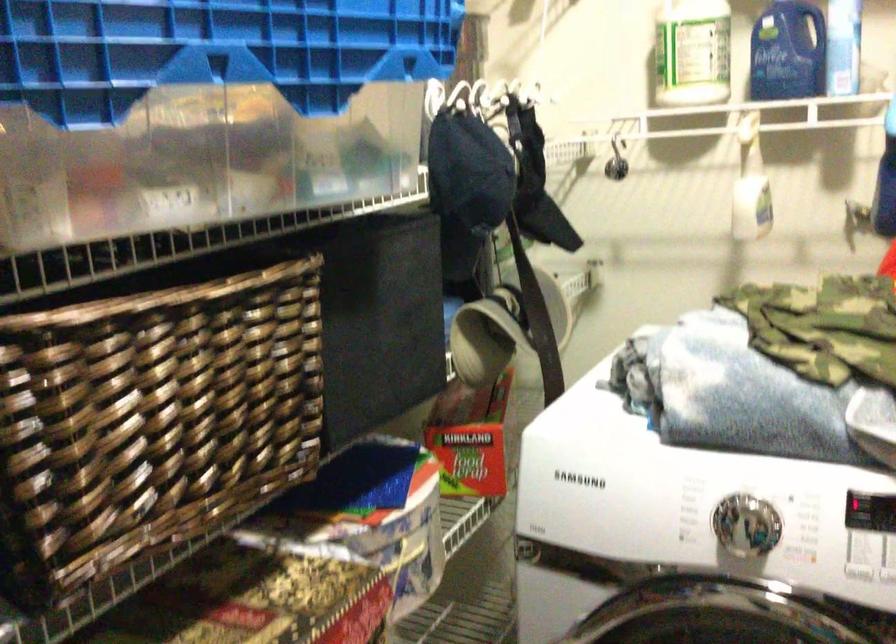
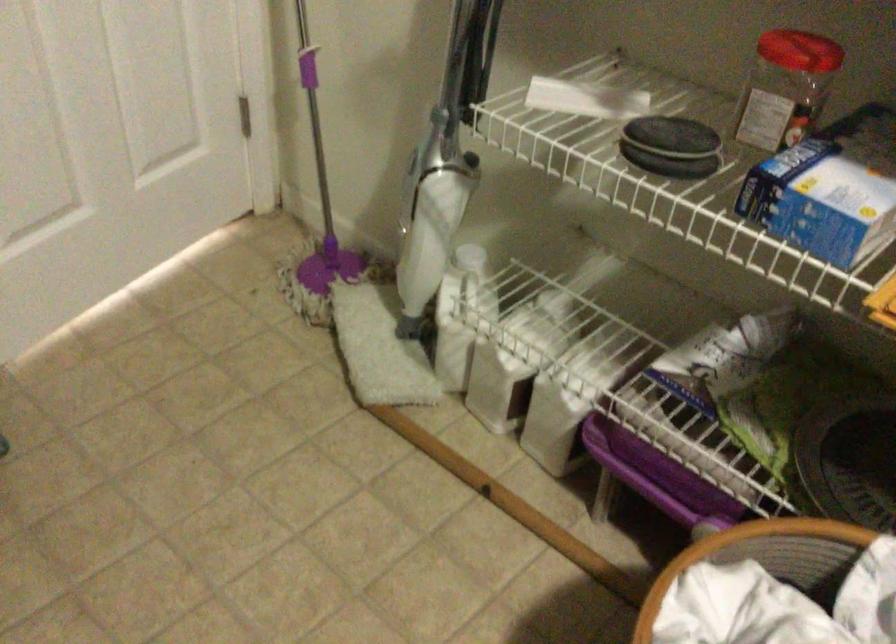
In the scene shown: How did the camera likely rotate?

The camera rotated toward left-down.